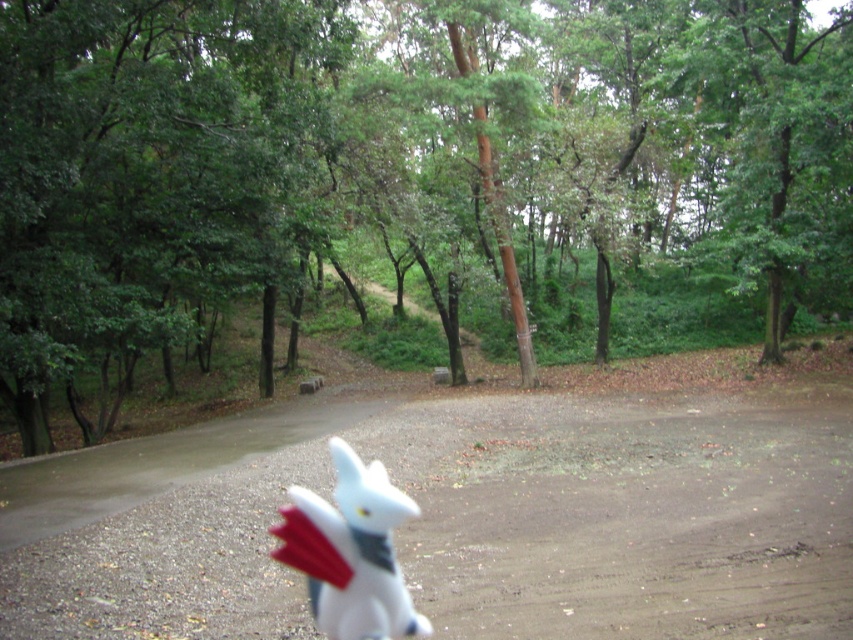
You are a hiker walking along the brown dirt track at center and want to take a photo of the green matte tree at center. Which direction should you face to ensure the tree is fully in the frame?

The green matte tree at center is positioned on the right side of brown dirt track at center. To ensure the tree is fully in the frame, you should face to the right side of the track where the tree is located.

You are a hiker who has just found a hidden treasure map. To follow the map, you need to know the distance between the green matte tree at center and the white matte plush toy at center in the forest. Can you determine if they are exactly 100 feet apart?

The green matte tree at center and white matte plush toy at center are 97.35 feet apart, so they are not exactly 100 feet apart.